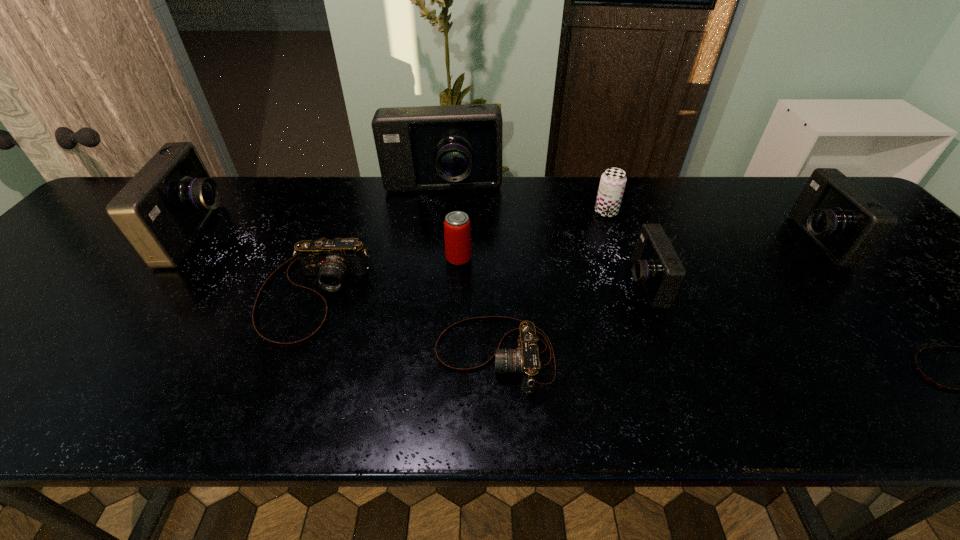
Where is `the tallest object`? This screenshot has width=960, height=540. the tallest object is located at coordinates (450, 147).

Locate an element on the screen. the third blue camera from right to left is located at coordinates (450, 147).

Find the location of a particular element. This screenshot has height=540, width=960. the leftmost blue camera is located at coordinates (161, 211).

Locate an element on the screen. This screenshot has width=960, height=540. the leftmost object is located at coordinates (161, 211).

This screenshot has height=540, width=960. In order to click on the third biggest blue camera in this screenshot , I will do `click(845, 222)`.

Identify the location of the third tallest camera. This screenshot has height=540, width=960. (845, 222).

Locate an element on the screen. This screenshot has width=960, height=540. purple beer can is located at coordinates (612, 184).

What are the coordinates of `the right beer can` in the screenshot? It's located at (612, 184).

The width and height of the screenshot is (960, 540). In order to click on the left beer can in this screenshot , I will do `click(457, 230)`.

This screenshot has height=540, width=960. Find the location of `the nearer beer can`. the nearer beer can is located at coordinates (457, 230).